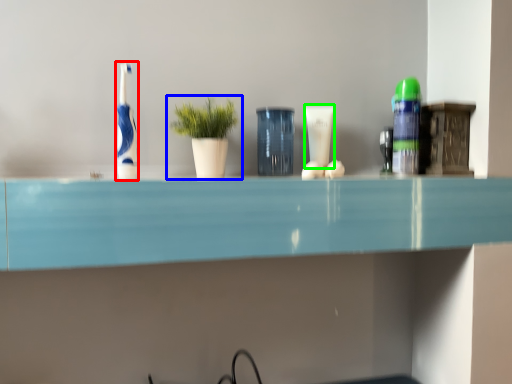
Question: Which object is the closest to the toothbrush (highlighted by a red box)? Choose among these: houseplant (highlighted by a blue box) or toiletry (highlighted by a green box).

Choices:
 (A) houseplant
 (B) toiletry

Answer: (A)